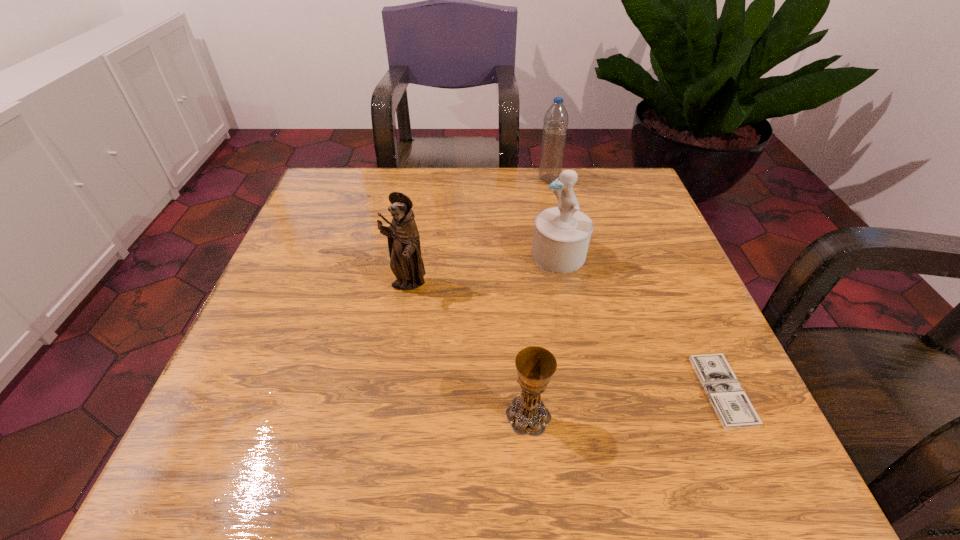
The height and width of the screenshot is (540, 960). I want to click on vacant area located 0.240m at the beak of the right figurine, so click(x=420, y=255).

This screenshot has width=960, height=540. Identify the location of vacant region located on the front-facing side of the left figurine. (380, 446).

The height and width of the screenshot is (540, 960). Find the location of `vacant space positioned 0.080m on the left of the fourth object from right to left`. vacant space positioned 0.080m on the left of the fourth object from right to left is located at coordinates (453, 415).

Locate an element on the screen. free location located on the back of the rightmost object is located at coordinates (652, 233).

Locate an element on the screen. Image resolution: width=960 pixels, height=540 pixels. object located at the far edge is located at coordinates (555, 126).

I want to click on chalice that is at the near edge, so click(x=527, y=414).

This screenshot has height=540, width=960. I want to click on dollar that is at the near edge, so click(x=734, y=409).

The image size is (960, 540). What are the coordinates of `object that is at the right edge` in the screenshot? It's located at click(734, 409).

Find the location of a particular element. object present at the near right corner is located at coordinates (734, 409).

This screenshot has width=960, height=540. Find the location of `vacant area at the far edge`. vacant area at the far edge is located at coordinates (487, 180).